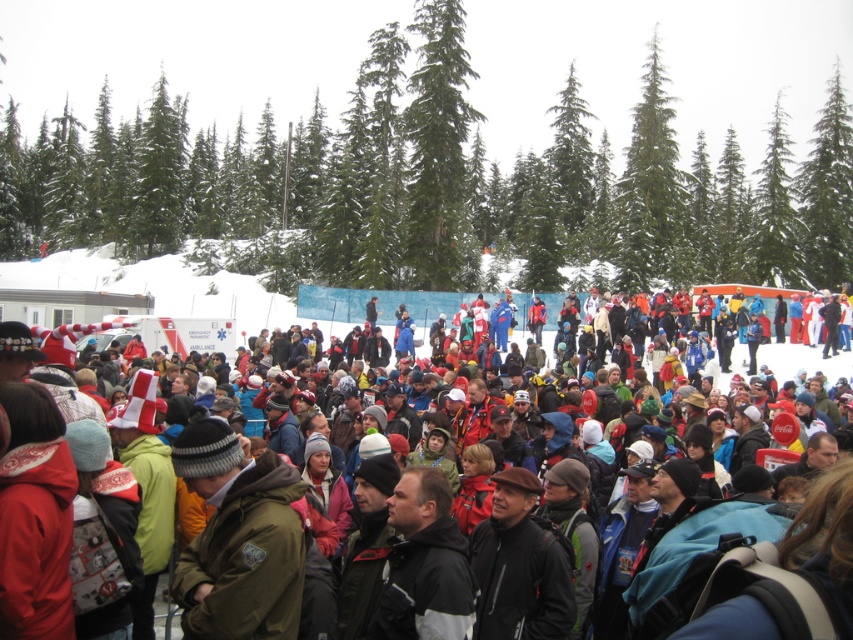
Is green textured trees at upper center thinner than matte black jacket at center?

In fact, green textured trees at upper center might be wider than matte black jacket at center.

Which is more to the right, green textured trees at upper center or matte black jacket at center?

matte black jacket at center is more to the right.

Is point (426, 200) positioned behind point (247, 330)?

Yes.

Find the location of a particular element. green textured trees at upper center is located at coordinates (442, 141).